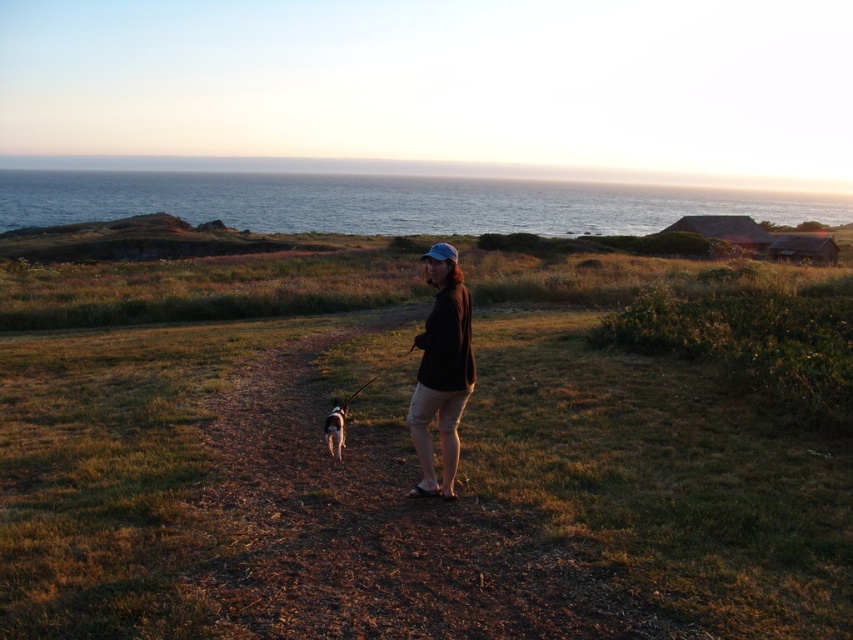
Question: Is brown matte jacket at center in front of white fur dog at center?

Choices:
 (A) no
 (B) yes

Answer: (B)

Question: Considering the relative positions of green grassy at center and white fur dog at center in the image provided, where is green grassy at center located with respect to white fur dog at center?

Choices:
 (A) above
 (B) below

Answer: (A)

Question: Among these points, which one is farthest from the camera?

Choices:
 (A) (421, 376)
 (B) (332, 422)

Answer: (B)

Question: Which of these objects is positioned farthest from the green grassy at center?

Choices:
 (A) brown dirt path at center
 (B) white fur dog at center
 (C) brown matte jacket at center

Answer: (B)

Question: Which point is closer to the camera?

Choices:
 (A) (451, 355)
 (B) (250, 556)
 (C) (113, 420)

Answer: (B)

Question: Does brown matte jacket at center appear on the right side of white fur dog at center?

Choices:
 (A) no
 (B) yes

Answer: (B)